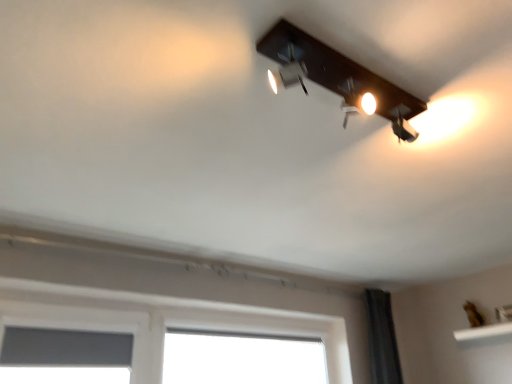
This screenshot has width=512, height=384. Find the location of `matte gray window screen at lower left`. matte gray window screen at lower left is located at coordinates (64, 348).

Measure the distance between point (x=108, y=333) and camera.

Point (x=108, y=333) is 2.34 meters away from camera.

What is the approximate width of matte gray window screen at lower left?

The width of matte gray window screen at lower left is 4.10 inches.

This screenshot has height=384, width=512. What do you see at coordinates (64, 348) in the screenshot? I see `matte gray window screen at lower left` at bounding box center [64, 348].

Locate an element on the screen. Image resolution: width=512 pixels, height=384 pixels. matte black light fixture at upper center is located at coordinates pos(338,78).

Describe the element at coordinates (338, 78) in the screenshot. I see `matte black light fixture at upper center` at that location.

Identify the location of matte gray window screen at lower left. This screenshot has width=512, height=384. (64, 348).

Considering the positions of objects matte gray window screen at lower left and matte black light fixture at upper center in the image provided, who is more to the left, matte gray window screen at lower left or matte black light fixture at upper center?

matte gray window screen at lower left is more to the left.

Who is more distant, matte gray window screen at lower left or matte black light fixture at upper center?

Positioned behind is matte gray window screen at lower left.

Which point is more distant from viewer, (55,329) or (380,115)?

The point (55,329) is behind.

From the image's perspective, who appears lower, matte gray window screen at lower left or matte black light fixture at upper center?

From the image's view, matte gray window screen at lower left is below.

From a real-world perspective, is matte gray window screen at lower left on top of matte black light fixture at upper center?

No.

Which object is thinner, matte gray window screen at lower left or matte black light fixture at upper center?

matte gray window screen at lower left.

Is matte gray window screen at lower left taller or shorter than matte black light fixture at upper center?

Clearly, matte gray window screen at lower left is taller compared to matte black light fixture at upper center.

Can you confirm if matte gray window screen at lower left is bigger than matte black light fixture at upper center?

Indeed, matte gray window screen at lower left has a larger size compared to matte black light fixture at upper center.

Is matte gray window screen at lower left not inside matte black light fixture at upper center?

matte gray window screen at lower left is positioned outside matte black light fixture at upper center.

Would you consider matte gray window screen at lower left to be distant from matte black light fixture at upper center?

That's right, there is a large distance between matte gray window screen at lower left and matte black light fixture at upper center.

Is matte gray window screen at lower left oriented towards matte black light fixture at upper center?

No, matte gray window screen at lower left is not facing towards matte black light fixture at upper center.

How many degrees apart are the facing directions of matte gray window screen at lower left and matte black light fixture at upper center?

The angular difference between matte gray window screen at lower left and matte black light fixture at upper center is 1.08 degrees.

Where is `window screen behind the matte black light fixture at upper center`? The width and height of the screenshot is (512, 384). window screen behind the matte black light fixture at upper center is located at coordinates (64, 348).

Which object is positioned more to the right, matte black light fixture at upper center or matte gray window screen at lower left?

Result: matte black light fixture at upper center is more to the right.

Is matte black light fixture at upper center in front of matte gray window screen at lower left?

Yes, it is in front of matte gray window screen at lower left.

Is point (369, 104) positioned behind point (62, 361)?

That is False.

From the image's perspective, relative to matte gray window screen at lower left, is matte black light fixture at upper center above or below?

Clearly, from the image's perspective, matte black light fixture at upper center is above matte gray window screen at lower left.

From a real-world perspective, is matte black light fixture at upper center on top of matte gray window screen at lower left?

Yes, from a real-world perspective, matte black light fixture at upper center is over matte gray window screen at lower left

Is matte black light fixture at upper center thinner than matte gray window screen at lower left?

No, matte black light fixture at upper center is not thinner than matte gray window screen at lower left.

Does matte black light fixture at upper center have a lesser height compared to matte gray window screen at lower left?

Yes.

Looking at the image, does matte black light fixture at upper center seem bigger or smaller compared to matte gray window screen at lower left?

In the image, matte black light fixture at upper center appears to be smaller than matte gray window screen at lower left.

Is matte black light fixture at upper center outside of matte gray window screen at lower left?

Absolutely, matte black light fixture at upper center is external to matte gray window screen at lower left.

Looking at this image, is matte black light fixture at upper center positioned far away from matte gray window screen at lower left?

Yes, matte black light fixture at upper center is far from matte gray window screen at lower left.

Does matte black light fixture at upper center turn towards matte gray window screen at lower left?

No, matte black light fixture at upper center is not turned towards matte gray window screen at lower left.

What's the angular difference between matte black light fixture at upper center and matte gray window screen at lower left's facing directions?

1.08 degrees separate the facing orientations of matte black light fixture at upper center and matte gray window screen at lower left.

At what (x,y) coordinates should I click in order to perform the action: click on lamp on the right of matte gray window screen at lower left. Please return your answer as a coordinate pair (x, y). Looking at the image, I should click on (338, 78).

The height and width of the screenshot is (384, 512). What are the coordinates of `window screen below the matte black light fixture at upper center (from the image's perspective)` in the screenshot? It's located at (64, 348).

Find the location of a particular element. The width and height of the screenshot is (512, 384). window screen that appears below the matte black light fixture at upper center (from a real-world perspective) is located at coordinates (64, 348).